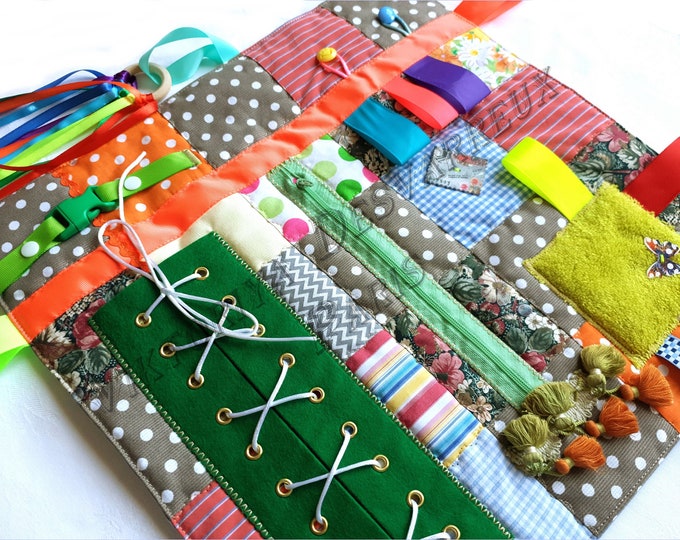
Identify the location of fabric sample. (330, 215).